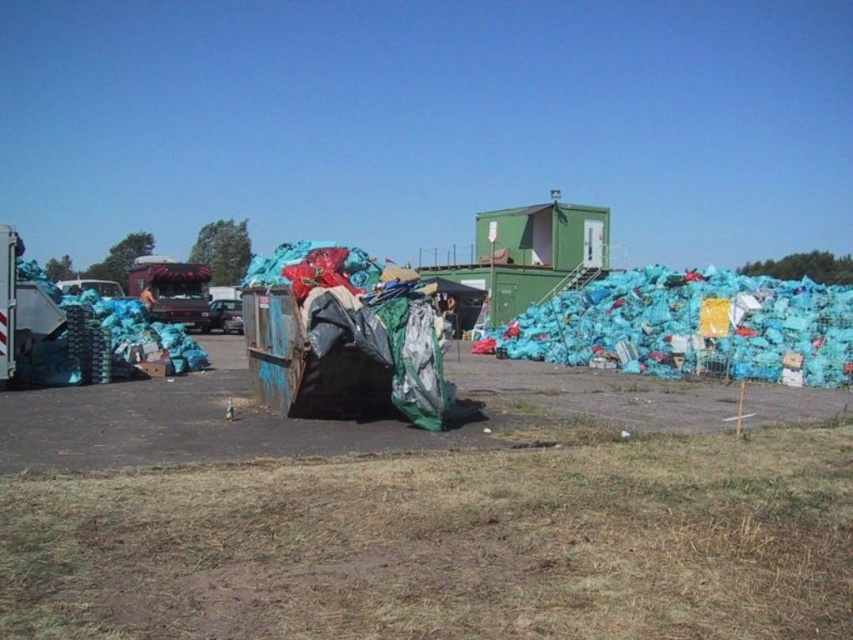
Question: Which object is farther from the camera taking this photo?

Choices:
 (A) rusty metal dumpster at center
 (B) blue plastic bags at left

Answer: (B)

Question: Estimate the real-world distances between objects in this image. Which object is closer to the rusty metal dumpster at center?

Choices:
 (A) brown dry grass at center
 (B) blue plastic bags at right

Answer: (A)

Question: Does brown dry grass at center have a lesser width compared to blue plastic bags at right?

Choices:
 (A) no
 (B) yes

Answer: (B)

Question: Which of the following is the farthest from the observer?

Choices:
 (A) blue plastic bags at right
 (B) brushed metal garbage truck at left
 (C) rusty metal dumpster at center
 (D) blue plastic bags at left

Answer: (B)

Question: Does rusty metal dumpster at center appear on the right side of brushed metal garbage truck at left?

Choices:
 (A) no
 (B) yes

Answer: (B)

Question: In this image, where is rusty metal dumpster at center located relative to blue plastic bags at left?

Choices:
 (A) above
 (B) below

Answer: (B)